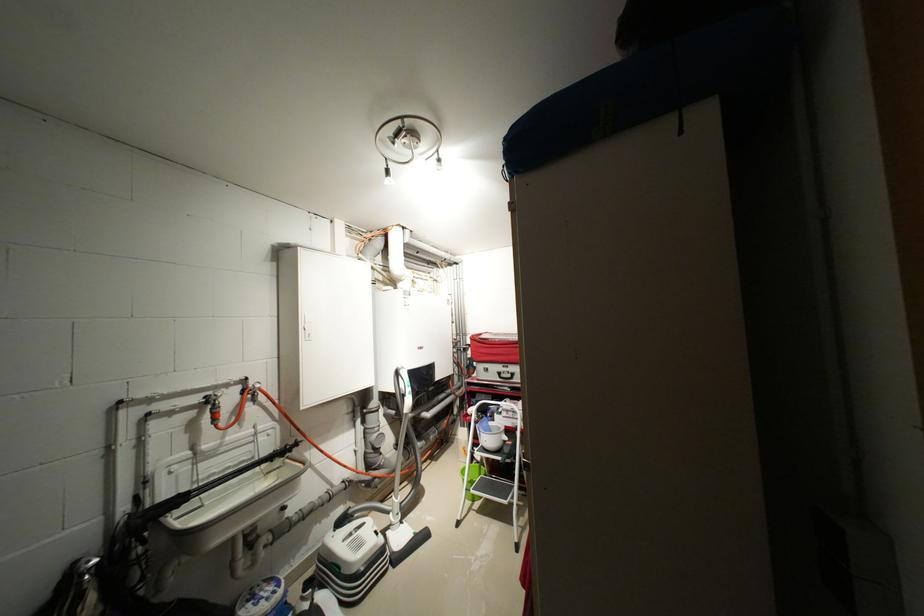
The width and height of the screenshot is (924, 616). What do you see at coordinates (490, 435) in the screenshot? I see `the white bucket handle` at bounding box center [490, 435].